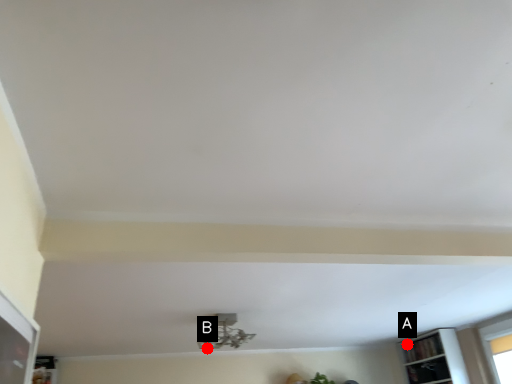
Question: Two points are circled on the image, labeled by A and B beside each circle. Among these points, which one is nearest to the camera?

Choices:
 (A) A is closer
 (B) B is closer

Answer: (B)